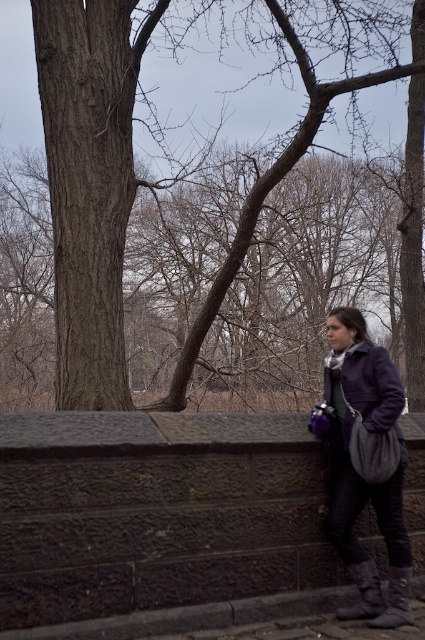
You are standing at the point with coordinates point (220, 273) and want to take a photo of the point with coordinates point (365, 394). However, there is a stone wall between you and the target point. According to the scene description, can you see the target point clearly?

Point (220, 273) is behind point (365, 394), so if you are at point (220, 273) and the stone wall is between you and the target point, you would be behind the target point and the wall might block your view. However, the scene description mentions the stone wall is at the bottom of the frame, so it might not obstruct the upper area where point (365, 394) is located. Therefore, you can see the target point clearly.

You are a photographer trying to capture the scene from the stone wall. You notice the brown textured bark at left and the matte purple coat at right. Which object would appear bigger in your photo?

The brown textured bark at left would appear bigger in the photo because it is larger in size than the matte purple coat at right.

You are a photographer trying to capture the brown textured bark at left and the matte purple coat at center in the same frame. Based on their positions, which object is higher in the image?

The brown textured bark at left is above the matte purple coat at center, so it is higher in the image.